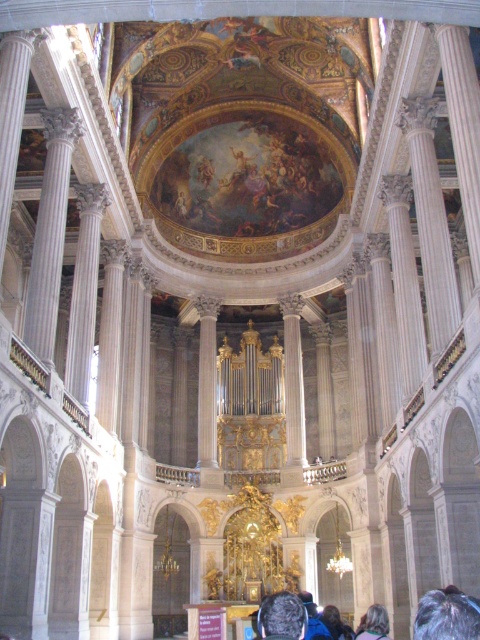
Question: Can you confirm if gray hair at upper center is smaller than dark gray hair at center?

Choices:
 (A) no
 (B) yes

Answer: (B)

Question: Which point is closer to the camera taking this photo?

Choices:
 (A) (451, 637)
 (B) (337, 632)
 (C) (372, 609)

Answer: (A)

Question: Which point is farther from the camera taking this photo?

Choices:
 (A) (268, 632)
 (B) (349, 637)
 (C) (474, 637)

Answer: (B)

Question: Which point is farther to the camera?

Choices:
 (A) gray fabric headband at center
 (B) gray hair at lower right
 (C) dark gray hair at center
 (D) gray hair at upper center

Answer: (A)

Question: Is gray hair at upper center to the right of gray fabric headband at center from the viewer's perspective?

Choices:
 (A) yes
 (B) no

Answer: (A)

Question: Is dark gray hair at center positioned behind gray fabric headband at center?

Choices:
 (A) no
 (B) yes

Answer: (A)